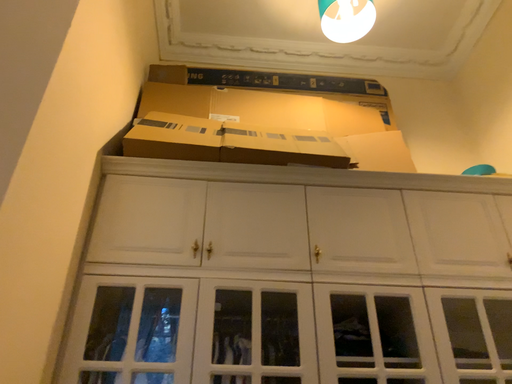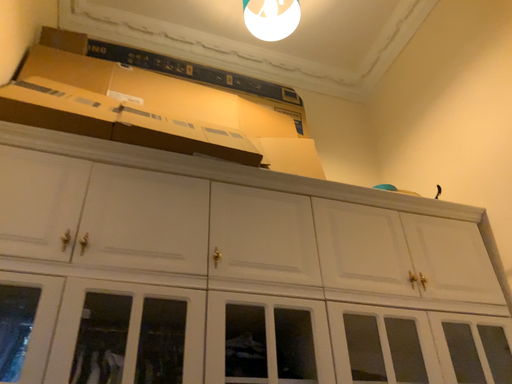
Question: Which way did the camera rotate in the video?

Choices:
 (A) rotated right
 (B) rotated left

Answer: (A)